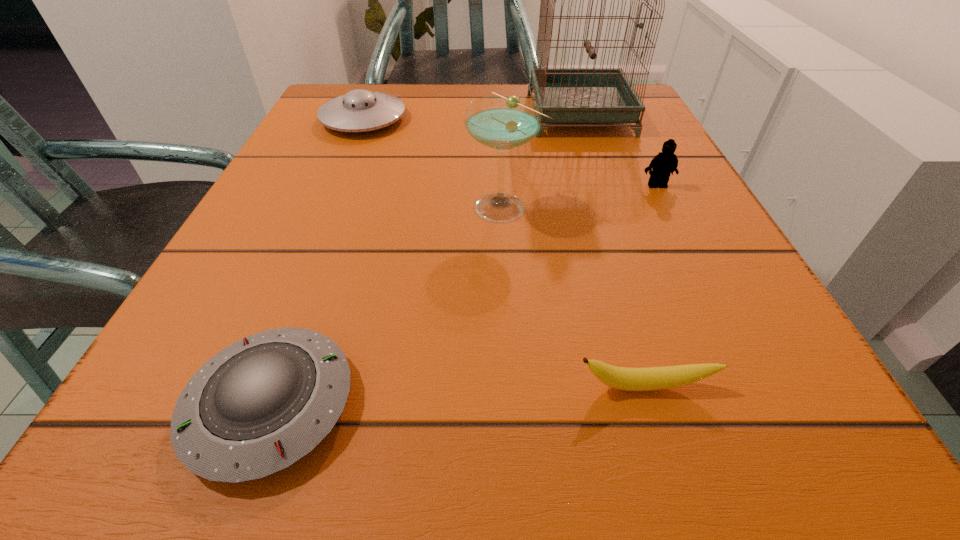
At what (x,y) coordinates should I click in order to perform the action: click on vacant space located at the door of the tallest object. Please return your answer as a coordinate pair (x, y). Looking at the image, I should click on (393, 114).

The width and height of the screenshot is (960, 540). I want to click on free space located 0.220m on the left of the third object from left to right, so click(x=326, y=206).

Find the location of a particular element. free space located on the face of the Lego is located at coordinates (767, 403).

I want to click on vacant space located on the right of the taller saucer, so click(571, 119).

Where is `vacant space situated on the right of the nearer saucer`? The image size is (960, 540). vacant space situated on the right of the nearer saucer is located at coordinates (627, 405).

This screenshot has width=960, height=540. Identify the location of birdcage that is positioned at the far edge. click(x=567, y=95).

Locate an element on the screen. saucer that is at the far edge is located at coordinates (359, 110).

Where is `object present at the near edge`? This screenshot has height=540, width=960. object present at the near edge is located at coordinates (261, 404).

Locate an element on the screen. birdcage at the right edge is located at coordinates (567, 95).

This screenshot has width=960, height=540. Identify the location of Lego located at the right edge. (665, 163).